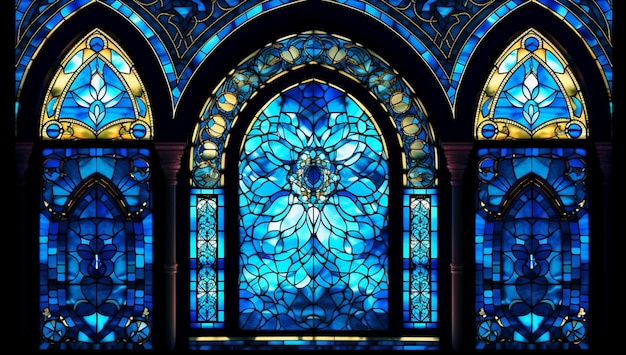
This screenshot has height=355, width=626. Identify the location of brown top part column right side. (453, 149).